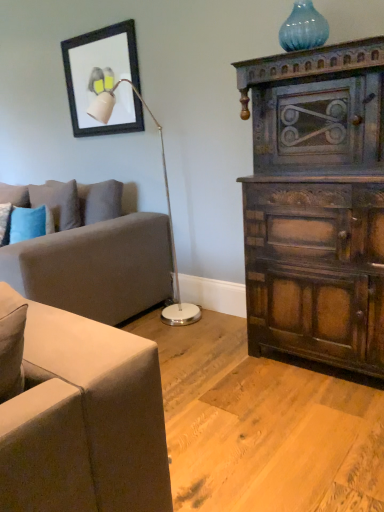
Measure the distance between white glossy floor lamp at upper left and camera.

The depth of white glossy floor lamp at upper left is 2.64 meters.

Looking at this image, measure the distance between soft gray fabric couch at left and camera.

soft gray fabric couch at left is 6.77 feet away from camera.

Where is `dark wood cabinet at right`? Image resolution: width=384 pixels, height=512 pixels. dark wood cabinet at right is located at coordinates (316, 204).

What is the approximate height of dark wood cabinet at right?

The height of dark wood cabinet at right is 4.81 feet.

Measure the distance between blue glass vase at upper right and camera.

They are 1.99 meters apart.

The width and height of the screenshot is (384, 512). In order to click on white glossy floor lamp at upper left in this screenshot , I will do `click(167, 206)`.

This screenshot has width=384, height=512. In order to click on vase lying above the dark wood cabinet at right (from the image's perspective) in this screenshot , I will do `click(303, 28)`.

Is there a large distance between blue glass vase at upper right and dark wood cabinet at right?

No, blue glass vase at upper right is not far from dark wood cabinet at right.

From the image's perspective, which one is positioned lower, blue glass vase at upper right or dark wood cabinet at right?

From the image's view, dark wood cabinet at right is below.

Consider the image. Which object is wider, blue glass vase at upper right or dark wood cabinet at right?

dark wood cabinet at right is wider.

Can you confirm if soft gray fabric couch at left is smaller than blue textured pillow at left?

Actually, soft gray fabric couch at left might be larger than blue textured pillow at left.

Which object is closer to the camera, soft gray fabric couch at left or blue textured pillow at left?

Positioned in front is soft gray fabric couch at left.

Considering the sizes of soft gray fabric couch at left and blue textured pillow at left in the image, is soft gray fabric couch at left wider or thinner than blue textured pillow at left?

Clearly, soft gray fabric couch at left has more width compared to blue textured pillow at left.

Can you tell me how much soft gray fabric couch at left and blue textured pillow at left differ in facing direction?

They differ by 2.06 degrees in their facing directions.

From a real-world perspective, is soft gray fabric couch at left physically above dark wood cabinet at right?

No.

How distant is soft gray fabric couch at left from dark wood cabinet at right?

soft gray fabric couch at left and dark wood cabinet at right are 3.67 feet apart from each other.

Which is more to the left, soft gray fabric couch at left or dark wood cabinet at right?

soft gray fabric couch at left.

Which is in front, point (105, 240) or point (347, 120)?

The point (347, 120) is closer to the camera.

Is dark wood cabinet at right to the right of white glossy floor lamp at upper left from the viewer's perspective?

Yes, dark wood cabinet at right is to the right of white glossy floor lamp at upper left.

Which of these two, dark wood cabinet at right or white glossy floor lamp at upper left, stands shorter?

dark wood cabinet at right is shorter.

Is dark wood cabinet at right spatially inside white glossy floor lamp at upper left, or outside of it?

The correct answer is: outside.

Considering the positions of points (293, 94) and (95, 101), is point (293, 94) farther from camera compared to point (95, 101)?

That is False.

Where is `chest of drawers below the blue textured pillow at left (from a real-world perspective)`? The height and width of the screenshot is (512, 384). chest of drawers below the blue textured pillow at left (from a real-world perspective) is located at coordinates (316, 204).

Could you tell me if blue textured pillow at left is facing dark wood cabinet at right?

No.

Considering the positions of point (80, 223) and point (375, 297), is point (80, 223) closer or farther from the camera than point (375, 297)?

Point (80, 223) is farther from the camera than point (375, 297).

Can you confirm if blue textured pillow at left is smaller than dark wood cabinet at right?

Yes.

In terms of width, does matte black picture frame at upper left look wider or thinner when compared to soft gray fabric couch at left?

matte black picture frame at upper left is thinner than soft gray fabric couch at left.

Is matte black picture frame at upper left to the left or to the right of soft gray fabric couch at left in the image?

matte black picture frame at upper left is to the right of soft gray fabric couch at left.

Which object is closer to the camera taking this photo, matte black picture frame at upper left or soft gray fabric couch at left?

soft gray fabric couch at left is in front.

Does matte black picture frame at upper left have a larger size compared to soft gray fabric couch at left?

No, matte black picture frame at upper left is not bigger than soft gray fabric couch at left.

How many degrees apart are the facing directions of dark wood cabinet at right and blue glass vase at upper right?

0.316 degrees.

In the scene shown: From the image's perspective, is dark wood cabinet at right below blue glass vase at upper right?

Yes, from the image's perspective, dark wood cabinet at right is beneath blue glass vase at upper right.

Is dark wood cabinet at right with blue glass vase at upper right?

No, dark wood cabinet at right is not beside blue glass vase at upper right.

Considering the positions of points (312, 227) and (322, 44), is point (312, 227) closer to camera compared to point (322, 44)?

That is True.

Find the location of a particular element. The height and width of the screenshot is (512, 384). the chest of drawers in front of the blue glass vase at upper right is located at coordinates coord(316,204).

I want to click on pillow above the soft gray fabric couch at left (from the image's perspective), so click(x=58, y=203).

Based on their spatial positions, is blue glass vase at upper right or matte black picture frame at upper left closer to soft gray fabric couch at left?

matte black picture frame at upper left.

When comparing their distances from blue textured pillow at left, does dark wood cabinet at right or blue glass vase at upper right seem further?

blue glass vase at upper right.

Considering their positions, is dark wood cabinet at right positioned further to blue textured pillow at left than white glossy floor lamp at upper left?

dark wood cabinet at right lies further to blue textured pillow at left than the other object.

From the picture: When comparing their distances from dark wood cabinet at right, does blue textured pillow at left or blue glass vase at upper right seem further?

blue textured pillow at left.

When comparing their distances from blue glass vase at upper right, does matte black picture frame at upper left or blue textured pillow at left seem further?

blue textured pillow at left lies further to blue glass vase at upper right than the other object.

Estimate the real-world distances between objects in this image. Which object is closer to dark wood cabinet at right, soft gray fabric couch at left or blue textured pillow at left?

soft gray fabric couch at left.

Looking at the image, which one is located closer to dark wood cabinet at right, white glossy floor lamp at upper left or blue textured pillow at left?

white glossy floor lamp at upper left is positioned closer to the anchor dark wood cabinet at right.

When comparing their distances from soft gray fabric couch at left, does dark wood cabinet at right or blue textured pillow at left seem closer?

blue textured pillow at left.

Find the location of `vase between blue textured pillow at left and dark wood cabinet at right`. vase between blue textured pillow at left and dark wood cabinet at right is located at coordinates [303, 28].

Locate an element on the screen. The image size is (384, 512). table lamp between matte black picture frame at upper left and soft gray fabric couch at left in the up-down direction is located at coordinates (167, 206).

Where is `pillow that lies between matte black picture frame at upper left and soft gray fabric couch at left from top to bottom`? pillow that lies between matte black picture frame at upper left and soft gray fabric couch at left from top to bottom is located at coordinates (58, 203).

Locate an element on the screen. table lamp situated between blue textured pillow at left and blue glass vase at upper right from left to right is located at coordinates (167, 206).